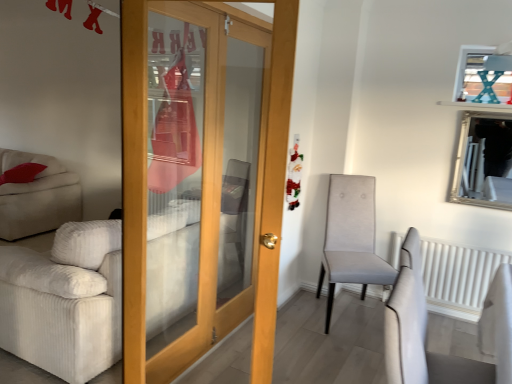
Locate an element on the screen. The image size is (512, 384). free spot to the left of light gray fabric chair at center-right is located at coordinates (293, 318).